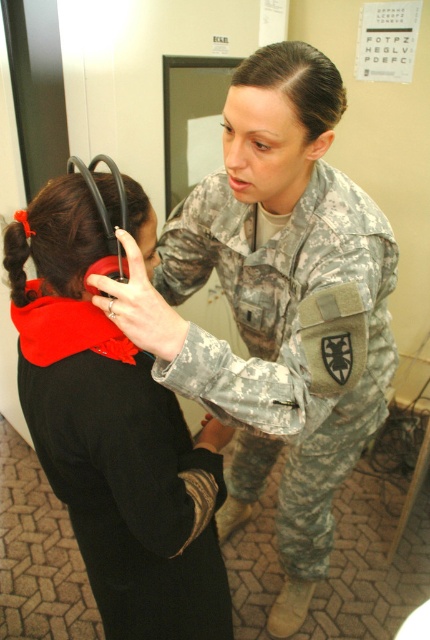
Question: Which point is closer to the camera?

Choices:
 (A) (326, 108)
 (B) (12, 280)
 (C) (11, 272)
 (D) (280, 230)

Answer: (C)

Question: Considering the relative positions of camouflage fabric uniform at center and black smooth hair at center in the image provided, where is camouflage fabric uniform at center located with respect to black smooth hair at center?

Choices:
 (A) right
 (B) left

Answer: (A)

Question: Can you confirm if red matte ear protection at upper left is wider than camouflage fabric uniform at center?

Choices:
 (A) yes
 (B) no

Answer: (B)

Question: Which point is farther to the camera?

Choices:
 (A) red matte ear protection at upper left
 (B) brown braided hair at upper left
 (C) black smooth hair at center
 (D) black fabric ponytail at upper left

Answer: (C)

Question: Which object is closer to the camera taking this photo?

Choices:
 (A) brown braided hair at upper left
 (B) black fabric ponytail at upper left
 (C) red matte ear protection at upper left
 (D) camouflage fabric uniform at center

Answer: (A)

Question: Observing the image, what is the correct spatial positioning of red matte ear protection at upper left in reference to camouflage fabric uniform at center?

Choices:
 (A) below
 (B) above

Answer: (B)